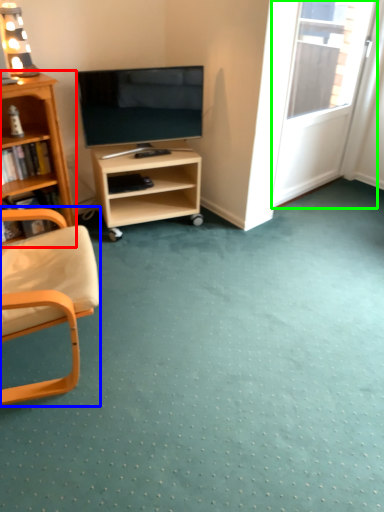
Question: Which is farther away from bookcase (highlighted by a red box)? chair (highlighted by a blue box) or screen door (highlighted by a green box)?

Choices:
 (A) chair
 (B) screen door

Answer: (B)